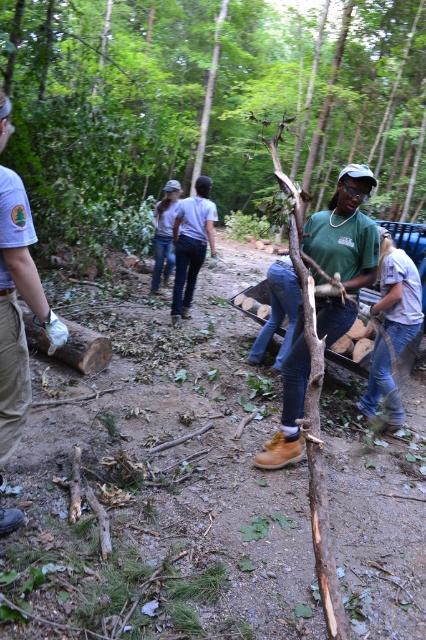
Question: Which point is farther from the camera taking this photo?

Choices:
 (A) (192, 211)
 (B) (164, 216)
 (C) (19, 221)

Answer: (B)

Question: Can you confirm if brown leather boots at center is thinner than light blue jeans at center?

Choices:
 (A) no
 (B) yes

Answer: (B)

Question: Among these points, which one is nearest to the camera?

Choices:
 (A) (16, 348)
 (B) (301, 337)
 (C) (204, 188)

Answer: (A)

Question: Is brown leather boots at center positioned before white cotton shirt at center?

Choices:
 (A) no
 (B) yes

Answer: (B)

Question: Is brown leather boots at center smaller than white cotton shirt at center?

Choices:
 (A) yes
 (B) no

Answer: (A)

Question: Which point appears farthest from the camera in this image?

Choices:
 (A) (160, 268)
 (B) (190, 172)
 (C) (342, 248)

Answer: (B)